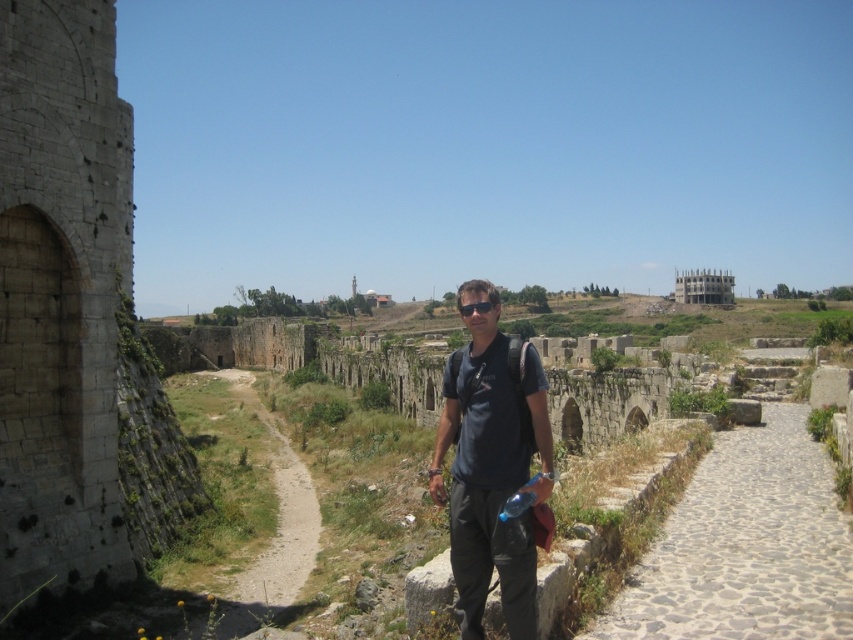
Is stone archway at left positioned before dark blue t-shirt at center?

No.

Measure the distance between stone archway at left and camera.

40.57 meters

Between point (79, 26) and point (490, 356), which one is positioned in front?

Point (490, 356)

Locate an element on the screen. The image size is (853, 640). stone archway at left is located at coordinates click(x=74, y=323).

Does gray cobblestone path at center-right have a greater height compared to dark blue t-shirt at center?

No, gray cobblestone path at center-right is not taller than dark blue t-shirt at center.

Can you confirm if gray cobblestone path at center-right is wider than dark blue t-shirt at center?

Indeed, gray cobblestone path at center-right has a greater width compared to dark blue t-shirt at center.

Does point (851, 627) lie behind point (498, 317)?

No, it is not.

Locate an element on the screen. gray cobblestone path at center-right is located at coordinates (746, 547).

Can you confirm if stone archway at left is shorter than gray cobblestone path at center-right?

In fact, stone archway at left may be taller than gray cobblestone path at center-right.

Between point (3, 157) and point (692, 593), which one is positioned behind?

Positioned behind is point (3, 157).

Locate an element on the screen. The height and width of the screenshot is (640, 853). stone archway at left is located at coordinates (74, 323).